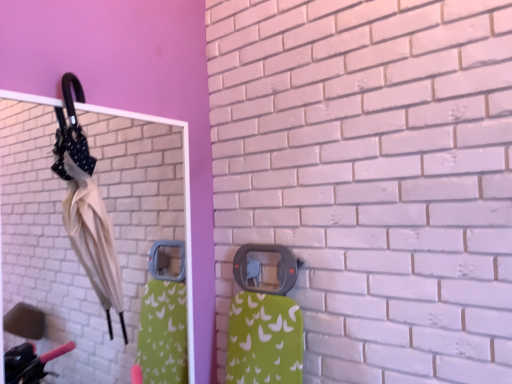
Question: Is beige fabric umbrella at left spatially inside white glossy mirror at upper left, or outside of it?

Choices:
 (A) inside
 (B) outside

Answer: (A)

Question: In terms of height, does beige fabric umbrella at left look taller or shorter compared to white glossy mirror at upper left?

Choices:
 (A) short
 (B) tall

Answer: (A)

Question: Estimate the real-world distances between objects in this image. Which object is farther from the white glossy mirror at upper left?

Choices:
 (A) matte plastic door handle at center
 (B) beige fabric umbrella at left

Answer: (A)

Question: Based on their relative distances, which object is farther from the beige fabric umbrella at left?

Choices:
 (A) matte plastic door handle at center
 (B) white glossy mirror at upper left

Answer: (B)